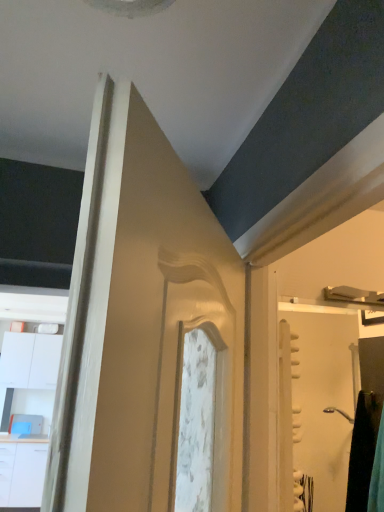
Question: From the image's perspective, is white glossy drawer at lower left located beneath white glossy screen door at right?

Choices:
 (A) yes
 (B) no

Answer: (A)

Question: Can you confirm if white glossy drawer at lower left is taller than white glossy screen door at right?

Choices:
 (A) no
 (B) yes

Answer: (B)

Question: Considering the relative positions of white glossy drawer at lower left and white glossy screen door at right in the image provided, is white glossy drawer at lower left to the right of white glossy screen door at right from the viewer's perspective?

Choices:
 (A) yes
 (B) no

Answer: (B)

Question: From the image's perspective, is white glossy drawer at lower left over white glossy screen door at right?

Choices:
 (A) no
 (B) yes

Answer: (A)

Question: Is white glossy drawer at lower left positioned in front of white glossy screen door at right?

Choices:
 (A) no
 (B) yes

Answer: (A)

Question: Is white glossy drawer at lower left directly adjacent to white glossy screen door at right?

Choices:
 (A) no
 (B) yes

Answer: (A)

Question: Is white glossy screen door at right positioned far away from white glossy cabinet at left?

Choices:
 (A) yes
 (B) no

Answer: (A)

Question: Does white glossy screen door at right lie behind white glossy cabinet at left?

Choices:
 (A) yes
 (B) no

Answer: (B)

Question: Is white glossy screen door at right positioned beyond the bounds of white glossy cabinet at left?

Choices:
 (A) yes
 (B) no

Answer: (A)

Question: Is white glossy screen door at right touching white glossy cabinet at left?

Choices:
 (A) yes
 (B) no

Answer: (B)

Question: From a real-world perspective, is white glossy screen door at right located beneath white glossy cabinet at left?

Choices:
 (A) yes
 (B) no

Answer: (B)

Question: Can you confirm if white glossy screen door at right is taller than white glossy cabinet at left?

Choices:
 (A) yes
 (B) no

Answer: (B)

Question: Is white glossy drawer at lower left turned away from white glossy cabinet at left?

Choices:
 (A) no
 (B) yes

Answer: (A)